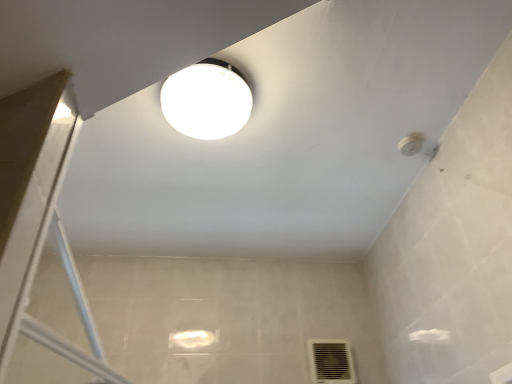
What do you see at coordinates (331, 361) in the screenshot? I see `black plastic air conditioning at lower right` at bounding box center [331, 361].

Identify the location of black plastic air conditioning at lower right. point(331,361).

What do you see at coordinates (207, 100) in the screenshot? I see `white glossy lamp at upper center` at bounding box center [207, 100].

Where is `white glossy lamp at upper center`? This screenshot has width=512, height=384. white glossy lamp at upper center is located at coordinates (207, 100).

What are the coordinates of `black plastic air conditioning at lower right` in the screenshot? It's located at (331, 361).

Is black plastic air conditioning at lower right at the left side of white glossy lamp at upper center?

In fact, black plastic air conditioning at lower right is to the right of white glossy lamp at upper center.

In the image, is black plastic air conditioning at lower right positioned in front of or behind white glossy lamp at upper center?

Clearly, black plastic air conditioning at lower right is behind white glossy lamp at upper center.

Considering the points (329, 360) and (237, 96), which point is behind, point (329, 360) or point (237, 96)?

Point (329, 360)

From the image's perspective, is black plastic air conditioning at lower right over white glossy lamp at upper center?

Actually, black plastic air conditioning at lower right appears below white glossy lamp at upper center in the image.

From a real-world perspective, is black plastic air conditioning at lower right below white glossy lamp at upper center?

Yes.

In terms of width, does black plastic air conditioning at lower right look wider or thinner when compared to white glossy lamp at upper center?

Considering their sizes, black plastic air conditioning at lower right looks slimmer than white glossy lamp at upper center.

In terms of height, does black plastic air conditioning at lower right look taller or shorter compared to white glossy lamp at upper center?

Considering their sizes, black plastic air conditioning at lower right has more height than white glossy lamp at upper center.

Does black plastic air conditioning at lower right have a larger size compared to white glossy lamp at upper center?

No.

Is black plastic air conditioning at lower right located outside white glossy lamp at upper center?

Yes, black plastic air conditioning at lower right is not within white glossy lamp at upper center.

Is black plastic air conditioning at lower right far from white glossy lamp at upper center?

Yes, black plastic air conditioning at lower right and white glossy lamp at upper center are quite far apart.

Is black plastic air conditioning at lower right looking in the opposite direction of white glossy lamp at upper center?

That's not correct — black plastic air conditioning at lower right is not looking away from white glossy lamp at upper center.

Can you tell me how much black plastic air conditioning at lower right and white glossy lamp at upper center differ in facing direction?

84.2 degrees.

Locate an element on the screen. The height and width of the screenshot is (384, 512). lamp on the left of black plastic air conditioning at lower right is located at coordinates (207, 100).

Considering the relative positions of white glossy lamp at upper center and black plastic air conditioning at lower right in the image provided, is white glossy lamp at upper center to the right of black plastic air conditioning at lower right from the viewer's perspective?

No, white glossy lamp at upper center is not to the right of black plastic air conditioning at lower right.

Which is behind, white glossy lamp at upper center or black plastic air conditioning at lower right?

black plastic air conditioning at lower right is further from the camera.

Does point (193, 100) appear closer or farther from the camera than point (343, 374)?

Point (193, 100) is closer to the camera than point (343, 374).

From the image's perspective, is white glossy lamp at upper center located above or below black plastic air conditioning at lower right?

white glossy lamp at upper center is situated higher than black plastic air conditioning at lower right in the image.

From a real-world perspective, who is located higher, white glossy lamp at upper center or black plastic air conditioning at lower right?

From a 3D spatial view, white glossy lamp at upper center is above.

Can you confirm if white glossy lamp at upper center is wider than black plastic air conditioning at lower right?

Indeed, white glossy lamp at upper center has a greater width compared to black plastic air conditioning at lower right.

Who is taller, white glossy lamp at upper center or black plastic air conditioning at lower right?

With more height is black plastic air conditioning at lower right.

Is white glossy lamp at upper center bigger or smaller than black plastic air conditioning at lower right?

Clearly, white glossy lamp at upper center is larger in size than black plastic air conditioning at lower right.

Can we say white glossy lamp at upper center lies outside black plastic air conditioning at lower right?

Yes.

Is white glossy lamp at upper center beside black plastic air conditioning at lower right?

They are not placed beside each other.

Consider the image. Is white glossy lamp at upper center looking in the opposite direction of black plastic air conditioning at lower right?

No.

How many degrees apart are the facing directions of white glossy lamp at upper center and black plastic air conditioning at lower right?

white glossy lamp at upper center and black plastic air conditioning at lower right are facing 84.2 degrees away from each other.

Where is `air conditioning below the white glossy lamp at upper center (from the image's perspective)`? The image size is (512, 384). air conditioning below the white glossy lamp at upper center (from the image's perspective) is located at coordinates (331, 361).

Locate an element on the screen. Image resolution: width=512 pixels, height=384 pixels. lamp on the left of black plastic air conditioning at lower right is located at coordinates (207, 100).

At what (x,y) coordinates should I click in order to perform the action: click on air conditioning below the white glossy lamp at upper center (from the image's perspective). Please return your answer as a coordinate pair (x, y). Looking at the image, I should click on (331, 361).